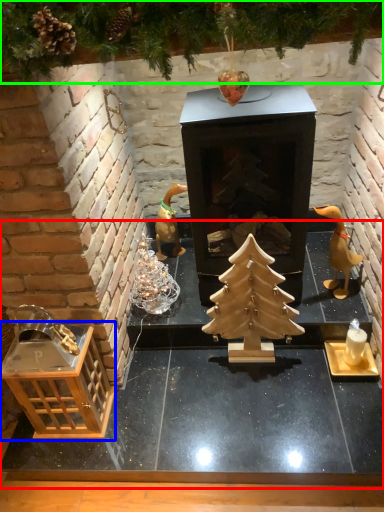
Question: Which object is the farthest from table (highlighted by a red box)? Choose among these: crate (highlighted by a blue box) or tree (highlighted by a green box).

Choices:
 (A) crate
 (B) tree

Answer: (B)